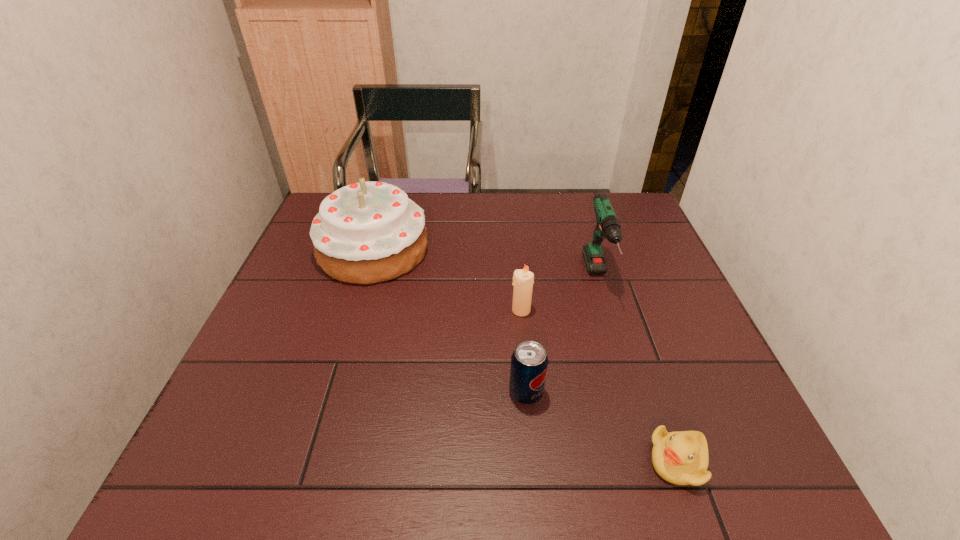
In order to click on free space located 0.380m on the right of the fourth tallest object in this screenshot , I will do `click(728, 393)`.

What are the coordinates of `free space located 0.240m on the front-facing side of the duckling` in the screenshot? It's located at (516, 462).

Identify the location of free location located 0.300m on the front-facing side of the duckling. (484, 462).

Locate an element on the screen. vacant area located on the front-facing side of the duckling is located at coordinates click(x=539, y=462).

Identify the location of object located at the far edge. (368, 232).

This screenshot has width=960, height=540. Find the location of `object that is at the near edge`. object that is at the near edge is located at coordinates (681, 458).

Identify the location of object that is at the left edge. This screenshot has width=960, height=540. (368, 232).

Locate an element on the screen. The image size is (960, 540). object present at the right edge is located at coordinates (681, 458).

The width and height of the screenshot is (960, 540). I want to click on object located at the far left corner, so click(x=368, y=232).

Image resolution: width=960 pixels, height=540 pixels. What are the coordinates of `object that is at the near right corner` in the screenshot? It's located at (681, 458).